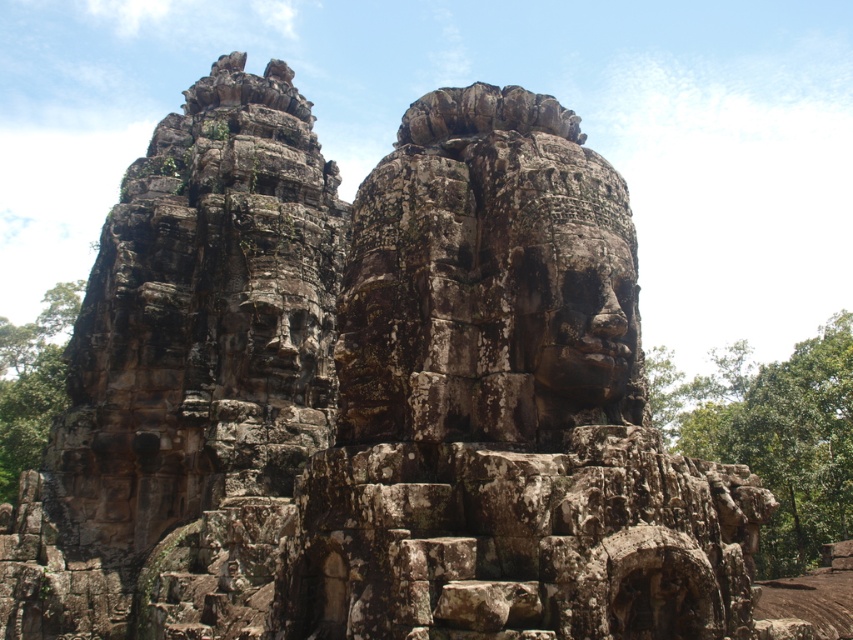
Between green leafy tree at right and green leafy tree at lower left, which one appears on the left side from the viewer's perspective?

Positioned to the left is green leafy tree at lower left.

Is point (804, 428) closer to viewer compared to point (15, 330)?

Yes, it is.

At what (x,y) coordinates should I click in order to perform the action: click on green leafy tree at right. Please return your answer as a coordinate pair (x, y). The image size is (853, 640). Looking at the image, I should click on (772, 433).

Between rough stone face at center and green leafy tree at lower left, which one is positioned lower?

green leafy tree at lower left

Does rough stone face at center have a greater width compared to green leafy tree at lower left?

No, rough stone face at center is not wider than green leafy tree at lower left.

This screenshot has height=640, width=853. I want to click on rough stone face at center, so click(581, 308).

Does green leafy tree at right have a greater width compared to rough stone face at center?

Correct, the width of green leafy tree at right exceeds that of rough stone face at center.

Who is positioned more to the right, green leafy tree at right or rough stone face at center?

Positioned to the right is green leafy tree at right.

Who is more distant from viewer, (695, 404) or (538, 282)?

Positioned behind is point (695, 404).

Find the location of a particular element. green leafy tree at right is located at coordinates (772, 433).